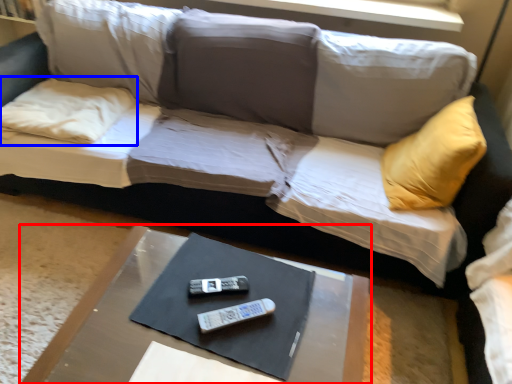
Question: Which of the following is the closest to the observer, table (highlighted by a red box) or pillow (highlighted by a blue box)?

Choices:
 (A) table
 (B) pillow

Answer: (A)